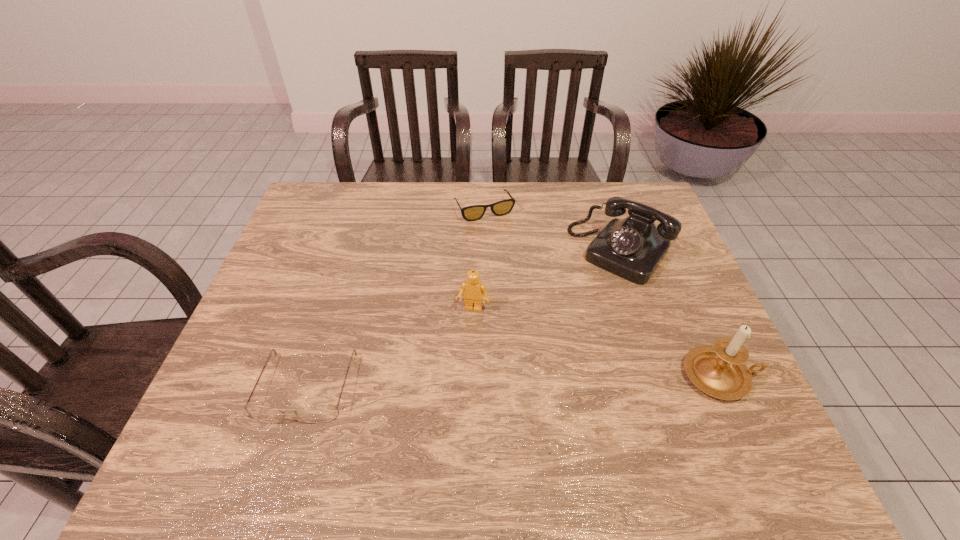
Where is `vacant area located on the front-facing side of the sunglasses`? vacant area located on the front-facing side of the sunglasses is located at coordinates (499, 234).

Locate an element on the screen. Image resolution: width=960 pixels, height=540 pixels. blank space located on the front-facing side of the sunglasses is located at coordinates (537, 305).

This screenshot has height=540, width=960. Find the location of `blank area located on the face of the Lego`. blank area located on the face of the Lego is located at coordinates (448, 406).

Identify the location of free region located 0.090m on the face of the Lego. (464, 343).

You are a GUI agent. You are given a task and a screenshot of the screen. Output one action in this format:
    pyautogui.click(x=<x>, y=<y>)
    Task: Click on the vacant space situated 0.160m on the face of the Lego
    
    Given the screenshot: What is the action you would take?
    pyautogui.click(x=458, y=367)

The image size is (960, 540). Find the location of `telephone at the far edge`. telephone at the far edge is located at coordinates (632, 248).

The width and height of the screenshot is (960, 540). In order to click on sunglasses at the far edge in this screenshot , I will do `click(470, 213)`.

Locate an element on the screen. Image resolution: width=960 pixels, height=540 pixels. spectacles that is at the near edge is located at coordinates (323, 413).

At what (x,y) coordinates should I click in order to perform the action: click on candle holder located in the near edge section of the desktop. Please return your answer as a coordinate pair (x, y). The width and height of the screenshot is (960, 540). Looking at the image, I should click on (719, 371).

In order to click on object present at the left edge in this screenshot , I will do `click(323, 413)`.